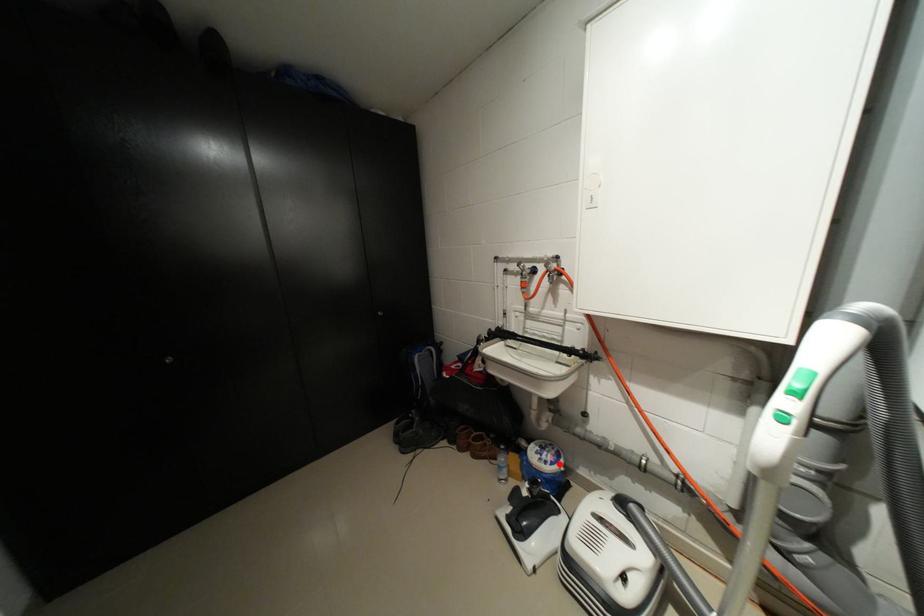
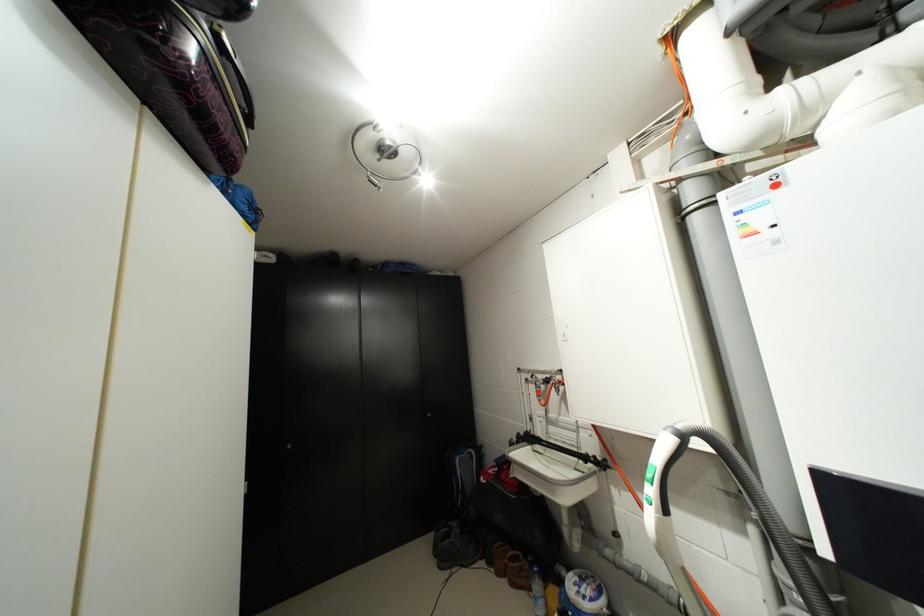
Where in the second image is the point corresponding to the highlighted location from the first image?

(599, 600)